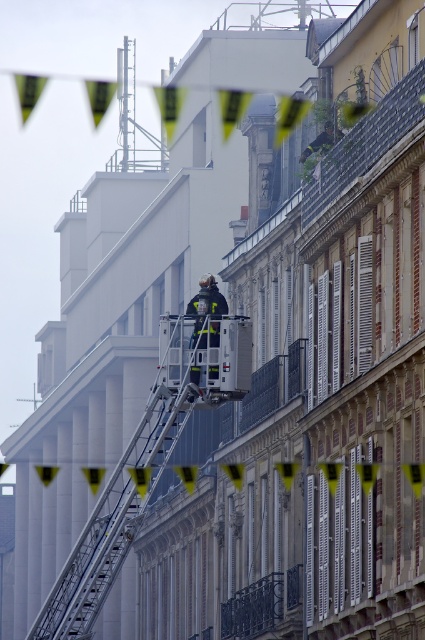
Question: Is metallic silver ladder at center above reflective silver fireman at center?

Choices:
 (A) no
 (B) yes

Answer: (A)

Question: Is the position of metallic silver ladder at center less distant than that of reflective silver fireman at center?

Choices:
 (A) yes
 (B) no

Answer: (A)

Question: Which point is farther to the camera?

Choices:
 (A) (87, 560)
 (B) (212, 310)

Answer: (B)

Question: Can you confirm if metallic silver ladder at center is bigger than reflective silver fireman at center?

Choices:
 (A) no
 (B) yes

Answer: (B)

Question: Which object appears farthest from the camera in this image?

Choices:
 (A) metallic silver ladder at center
 (B) reflective silver fireman at center

Answer: (B)